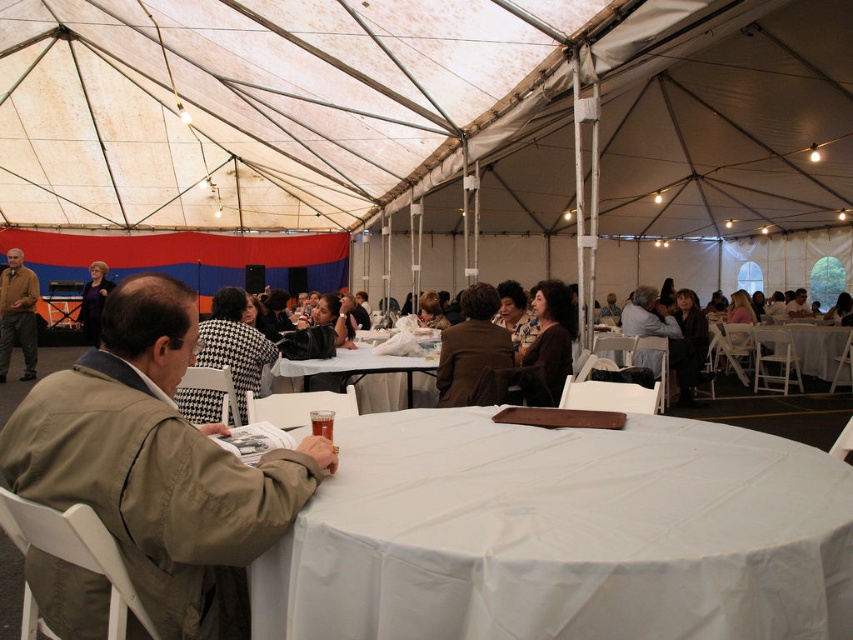
You are at the entrance of the tent and want to place a decoration exactly at the center of the white cloth at center. What coordinates should you aim for?

The white cloth at center is located at coordinates point (561, 534), so you should aim for those coordinates to place the decoration exactly at its center.

You are a guest at the event and want to retrieve your jacket from the coat rack. Both the tan fabric jacket at left and the brown leather jacket at left are hanging on the rack. Which one is closer to the bottom of the rack?

The tan fabric jacket at left is below the brown leather jacket at left, so it is closer to the bottom of the rack.